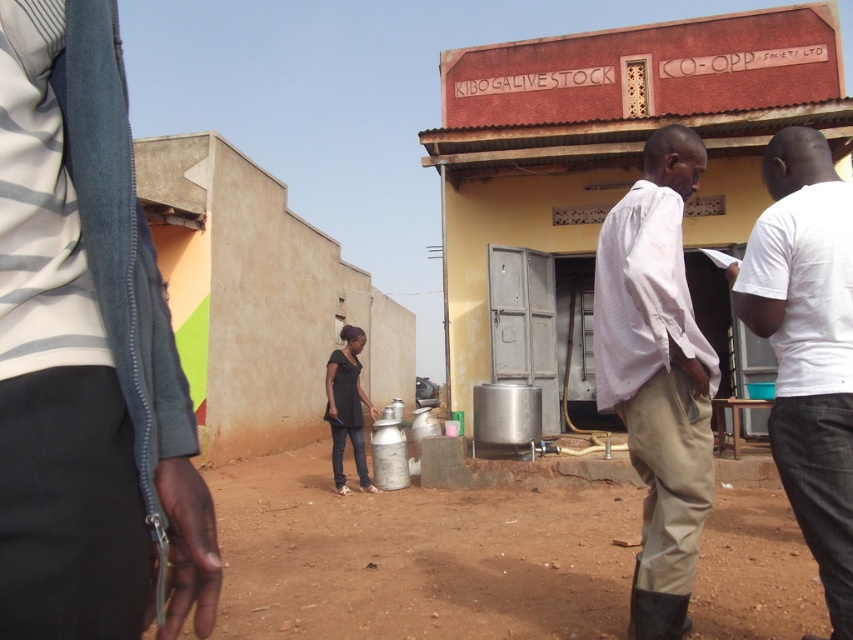
Question: Which point is farther to the camera?

Choices:
 (A) black matte dress at center
 (B) white cotton shirt at center

Answer: (A)

Question: Is metallic silver tank at center below white cotton shirt at center?

Choices:
 (A) yes
 (B) no

Answer: (B)

Question: Is beige concrete wall at center smaller than black matte dress at center?

Choices:
 (A) no
 (B) yes

Answer: (A)

Question: Which point is closer to the camera?

Choices:
 (A) (654, 422)
 (B) (339, 582)

Answer: (A)

Question: Does brown dirt field at center have a greater width compared to black matte dress at center?

Choices:
 (A) yes
 (B) no

Answer: (B)

Question: Which point appears farthest from the camera in this image?

Choices:
 (A) (663, 444)
 (B) (566, 532)
 (C) (262, 333)

Answer: (C)